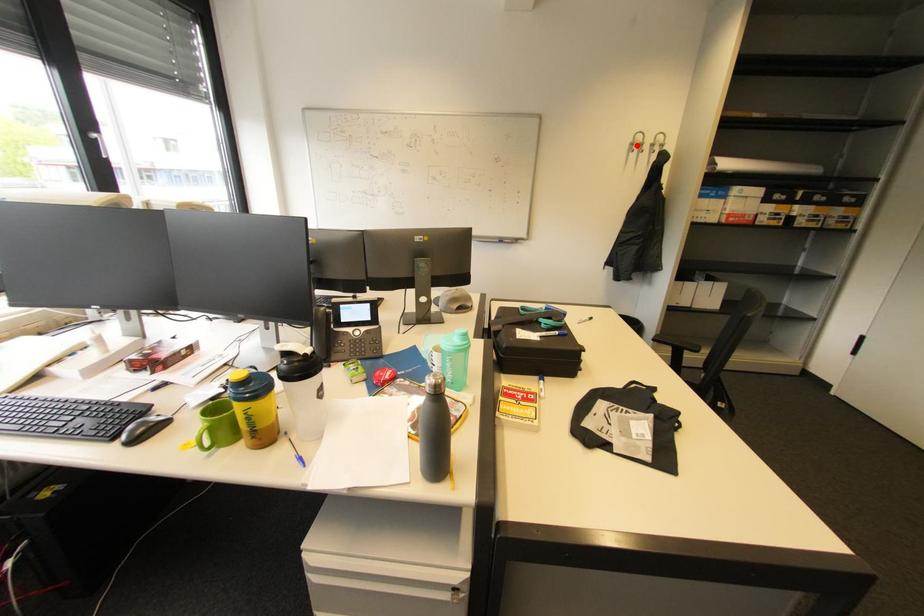
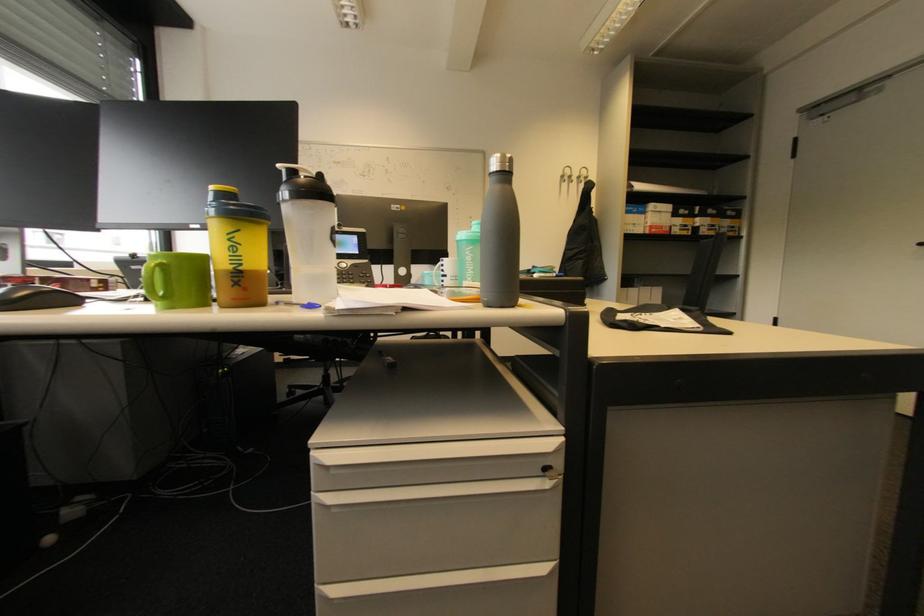
Find the pixel in the second image that matches the highlighted location in the first image.

(567, 177)